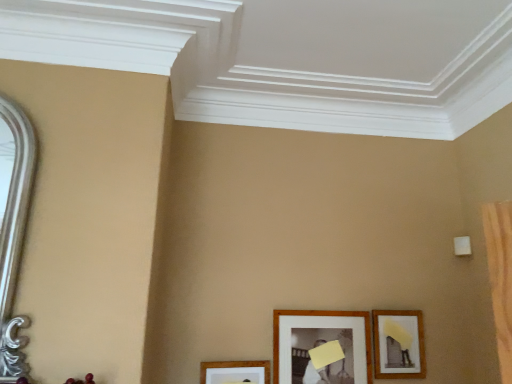
Question: Considering the relative sizes of wooden framed picture at lower right, the third picture frame when ordered from left to right, and wooden picture frame at lower center, the first picture frame positioned from the left, in the image provided, is wooden framed picture at lower right, the third picture frame when ordered from left to right, thinner than wooden picture frame at lower center, the first picture frame positioned from the left,?

Choices:
 (A) no
 (B) yes

Answer: (A)

Question: Is wooden framed picture at lower right, the third picture frame when ordered from left to right, positioned beyond the bounds of wooden picture frame at lower center, the first picture frame positioned from the left?

Choices:
 (A) no
 (B) yes

Answer: (B)

Question: Is wooden picture frame at lower center, the first picture frame positioned from the left, at the back of wooden framed picture at lower right, placed as the first picture frame when sorted from right to left?

Choices:
 (A) no
 (B) yes

Answer: (A)

Question: From a real-world perspective, is wooden framed picture at lower right, placed as the first picture frame when sorted from right to left, on top of wooden picture frame at lower center, the first picture frame positioned from the left?

Choices:
 (A) yes
 (B) no

Answer: (A)

Question: Does wooden framed picture at lower right, placed as the first picture frame when sorted from right to left, come behind wooden picture frame at lower center, the first picture frame positioned from the left?

Choices:
 (A) yes
 (B) no

Answer: (A)

Question: From their relative heights in the image, would you say wooden framed picture at lower right, the third picture frame when ordered from left to right, is taller or shorter than wooden picture frame at lower center, placed as the 2th picture frame when sorted from left to right?

Choices:
 (A) short
 (B) tall

Answer: (A)

Question: From a real-world perspective, is wooden framed picture at lower right, the third picture frame when ordered from left to right, positioned above or below wooden picture frame at lower center, placed as the 2th picture frame when sorted from left to right?

Choices:
 (A) below
 (B) above

Answer: (B)

Question: From the image's perspective, relative to wooden picture frame at lower center, placed as the 2th picture frame when sorted from left to right, is wooden framed picture at lower right, placed as the first picture frame when sorted from right to left, above or below?

Choices:
 (A) above
 (B) below

Answer: (A)

Question: Considering the relative positions of wooden framed picture at lower right, placed as the first picture frame when sorted from right to left, and wooden picture frame at lower center, which is counted as the second picture frame, starting from the right, in the image provided, is wooden framed picture at lower right, placed as the first picture frame when sorted from right to left, to the left or to the right of wooden picture frame at lower center, which is counted as the second picture frame, starting from the right,?

Choices:
 (A) right
 (B) left

Answer: (A)

Question: Choose the correct answer: Is wooden picture frame at lower center, which is counted as the second picture frame, starting from the right, inside wooden picture frame at lower center, the 3th picture frame viewed from the right, or outside it?

Choices:
 (A) outside
 (B) inside

Answer: (A)

Question: Looking at the image, does wooden picture frame at lower center, placed as the 2th picture frame when sorted from left to right, seem bigger or smaller compared to wooden picture frame at lower center, the 3th picture frame viewed from the right?

Choices:
 (A) small
 (B) big

Answer: (B)

Question: In the image, is wooden picture frame at lower center, which is counted as the second picture frame, starting from the right, positioned in front of or behind wooden picture frame at lower center, the first picture frame positioned from the left?

Choices:
 (A) behind
 (B) front

Answer: (A)

Question: Considering the positions of point (336, 350) and point (231, 380), is point (336, 350) closer or farther from the camera than point (231, 380)?

Choices:
 (A) farther
 (B) closer

Answer: (A)

Question: Is wooden picture frame at lower center, placed as the 2th picture frame when sorted from left to right, taller or shorter than wooden framed picture at lower right, the third picture frame when ordered from left to right?

Choices:
 (A) tall
 (B) short

Answer: (A)

Question: Considering the positions of point (365, 317) and point (375, 357), is point (365, 317) closer or farther from the camera than point (375, 357)?

Choices:
 (A) farther
 (B) closer

Answer: (A)